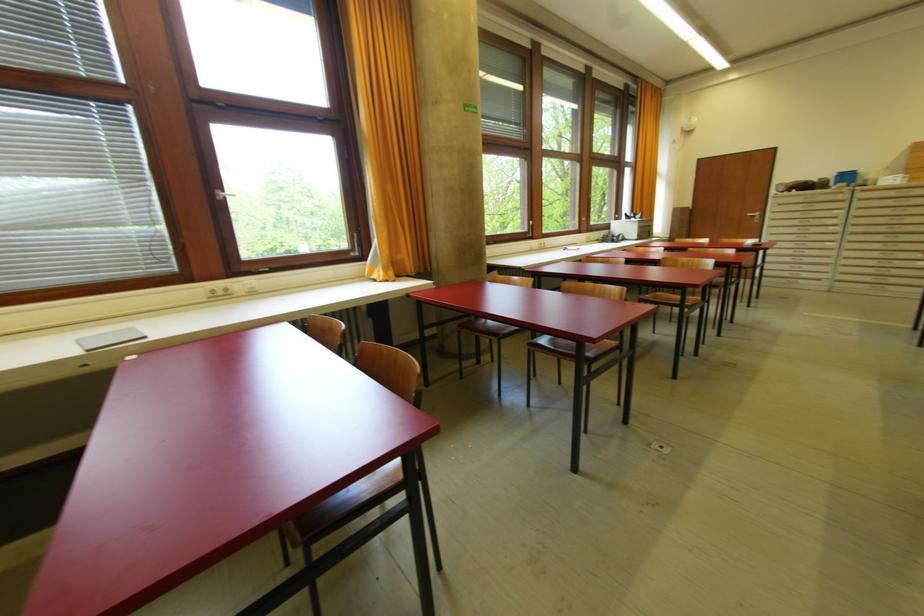
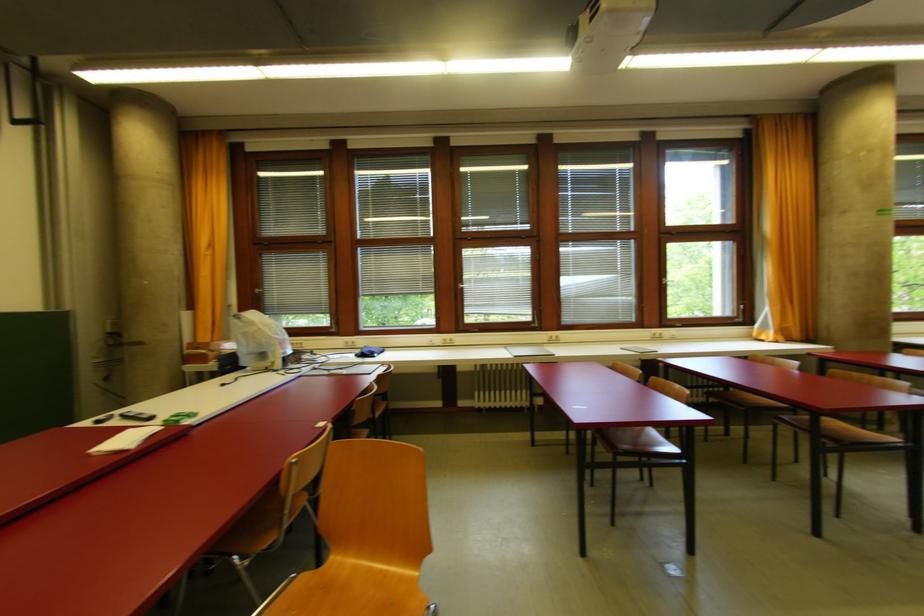
Question: I am providing you with two images of the same scene from different viewpoints. After the viewpoint changes to image2, which objects are now occluded?

Choices:
 (A) dark window handle
 (B) black smartphone
 (C) white power outlet
 (D) none of these

Answer: (D)